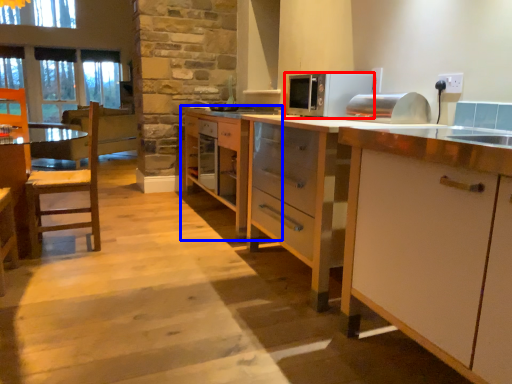
Question: Which object is further to the camera taking this photo, microwave oven (highlighted by a red box) or cabinetry (highlighted by a blue box)?

Choices:
 (A) microwave oven
 (B) cabinetry

Answer: (B)